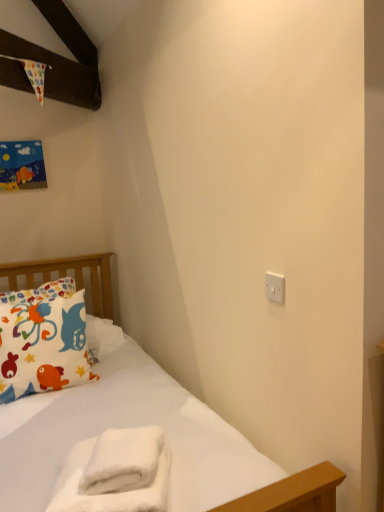
Question: Considering the relative sizes of printed fabric pillow at left and white plastic switch at upper right in the image provided, is printed fabric pillow at left bigger than white plastic switch at upper right?

Choices:
 (A) no
 (B) yes

Answer: (B)

Question: From the image's perspective, is printed fabric pillow at left above white plastic switch at upper right?

Choices:
 (A) yes
 (B) no

Answer: (B)

Question: Is printed fabric pillow at left positioned beyond the bounds of white plastic switch at upper right?

Choices:
 (A) yes
 (B) no

Answer: (A)

Question: Is printed fabric pillow at left taller than white plastic switch at upper right?

Choices:
 (A) no
 (B) yes

Answer: (B)

Question: Is printed fabric pillow at left positioned behind white plastic switch at upper right?

Choices:
 (A) no
 (B) yes

Answer: (B)

Question: Is white plastic switch at upper right completely or partially inside printed fabric pillow at left?

Choices:
 (A) no
 (B) yes

Answer: (A)

Question: Is printed fabric pillow at left not inside white fluffy towel at lower center?

Choices:
 (A) no
 (B) yes

Answer: (B)

Question: Does printed fabric pillow at left lie in front of white fluffy towel at lower center?

Choices:
 (A) yes
 (B) no

Answer: (B)

Question: Is printed fabric pillow at left facing away from white fluffy towel at lower center?

Choices:
 (A) yes
 (B) no

Answer: (B)

Question: Is printed fabric pillow at left at the left side of white fluffy towel at lower center?

Choices:
 (A) no
 (B) yes

Answer: (B)

Question: Is printed fabric pillow at left shorter than white fluffy towel at lower center?

Choices:
 (A) no
 (B) yes

Answer: (A)

Question: Are printed fabric pillow at left and white fluffy towel at lower center far apart?

Choices:
 (A) yes
 (B) no

Answer: (B)

Question: Can you confirm if white plastic switch at upper right is taller than white fluffy towel at lower center?

Choices:
 (A) no
 (B) yes

Answer: (A)